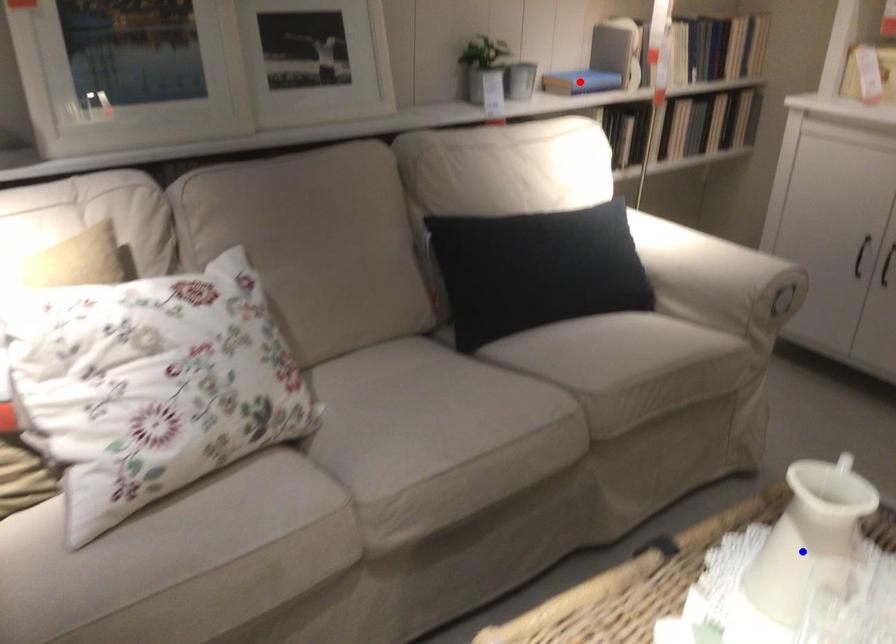
Question: Which of the two points in the image is closer to the camera?

Choices:
 (A) Blue point is closer.
 (B) Red point is closer.

Answer: (A)